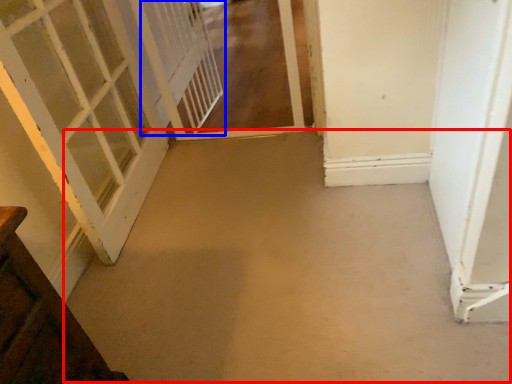
Question: Which object appears closest to the camera in this image, concrete (highlighted by a red box) or screen door (highlighted by a blue box)?

Choices:
 (A) concrete
 (B) screen door

Answer: (A)